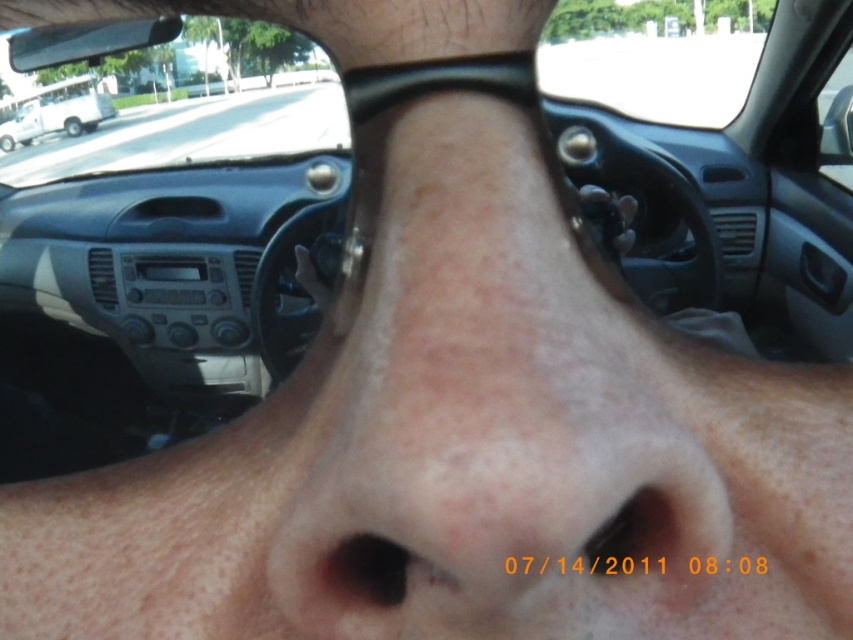
Question: Among these points, which one is farthest from the camera?

Choices:
 (A) (213, 109)
 (B) (80, 132)

Answer: (B)

Question: Is transparent glass car window at upper center above white matte van at upper left?

Choices:
 (A) yes
 (B) no

Answer: (A)

Question: Which object is closer to the camera taking this photo?

Choices:
 (A) white matte van at upper left
 (B) transparent glass car window at upper center

Answer: (B)

Question: Is transparent glass car window at upper center to the left of white matte van at upper left from the viewer's perspective?

Choices:
 (A) no
 (B) yes

Answer: (B)

Question: Does transparent glass car window at upper center have a larger size compared to white matte van at upper left?

Choices:
 (A) no
 (B) yes

Answer: (B)